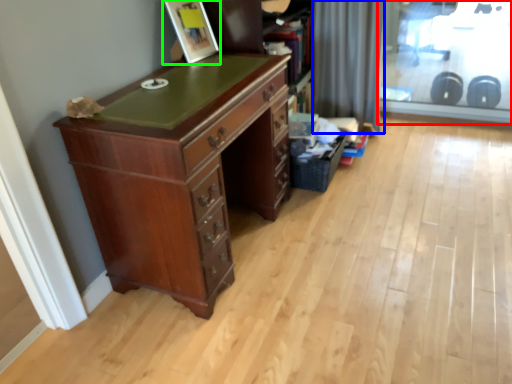
Question: Which object is the farthest from screen door (highlighted by a red box)? Choose among these: curtain (highlighted by a blue box) or picture frame (highlighted by a green box).

Choices:
 (A) curtain
 (B) picture frame

Answer: (B)